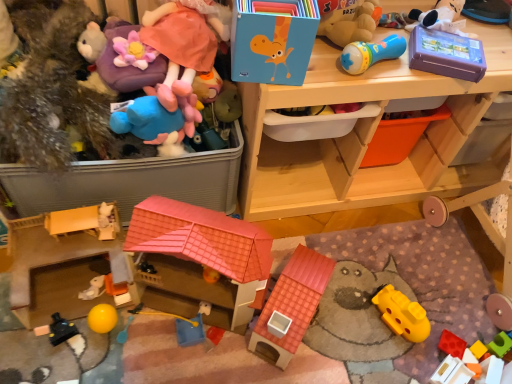
This screenshot has height=384, width=512. In order to click on vacant space in between white plush toy at lower left, the third toy positioned from the left, and white plastic toy at lower right, the twelfth toy from the left in this screenshot , I will do (298, 346).